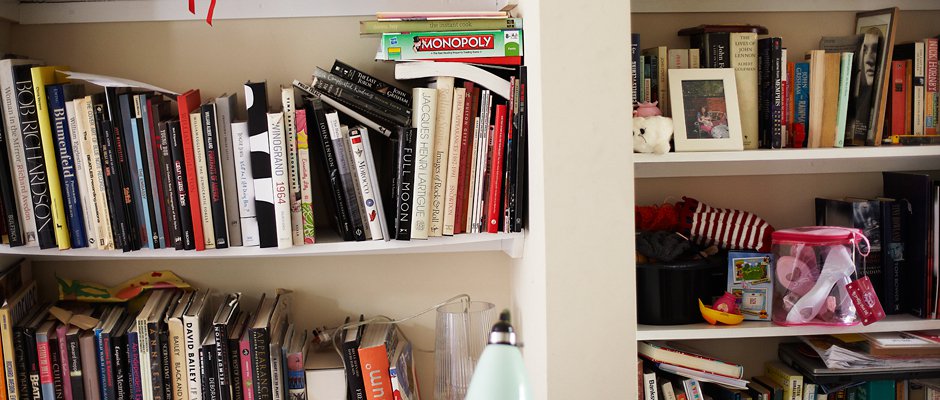
You are a GUI agent. You are given a task and a screenshot of the screen. Output one action in this format:
    pyautogui.click(x=<x>, y=<y>)
    Task: Click on the lamp light cover
    The image size is (940, 400).
    Given the screenshot: What is the action you would take?
    pyautogui.click(x=457, y=330), pyautogui.click(x=503, y=383)